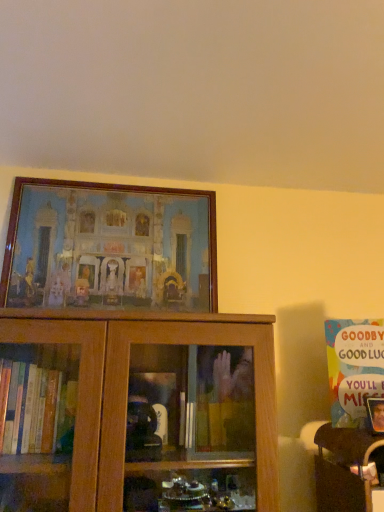
Question: Should I look upward or downward to see wooden picture frame at upper center?

Choices:
 (A) down
 (B) up

Answer: (B)

Question: Is wooden picture frame at upper center bigger than multicolored paper card at upper right?

Choices:
 (A) yes
 (B) no

Answer: (A)

Question: Would you consider wooden picture frame at upper center to be distant from multicolored paper card at upper right?

Choices:
 (A) no
 (B) yes

Answer: (A)

Question: Is wooden picture frame at upper center further to the viewer compared to multicolored paper card at upper right?

Choices:
 (A) yes
 (B) no

Answer: (A)

Question: Is wooden picture frame at upper center wider than multicolored paper card at upper right?

Choices:
 (A) yes
 (B) no

Answer: (A)

Question: Does wooden picture frame at upper center come in front of multicolored paper card at upper right?

Choices:
 (A) no
 (B) yes

Answer: (A)

Question: From the image's perspective, is wooden picture frame at upper center on multicolored paper card at upper right?

Choices:
 (A) yes
 (B) no

Answer: (A)

Question: From the image's perspective, is wooden picture frame at upper center under wooden table at lower right?

Choices:
 (A) yes
 (B) no

Answer: (B)

Question: Considering the relative positions of wooden picture frame at upper center and wooden table at lower right in the image provided, is wooden picture frame at upper center to the left of wooden table at lower right from the viewer's perspective?

Choices:
 (A) yes
 (B) no

Answer: (A)

Question: Is wooden picture frame at upper center thinner than wooden table at lower right?

Choices:
 (A) no
 (B) yes

Answer: (B)

Question: Does wooden picture frame at upper center appear on the right side of wooden table at lower right?

Choices:
 (A) no
 (B) yes

Answer: (A)

Question: Is wooden picture frame at upper center looking in the opposite direction of wooden table at lower right?

Choices:
 (A) no
 (B) yes

Answer: (A)

Question: Does wooden picture frame at upper center have a larger size compared to wooden table at lower right?

Choices:
 (A) yes
 (B) no

Answer: (A)

Question: Can we say wooden table at lower right lies outside wooden picture frame at upper center?

Choices:
 (A) no
 (B) yes

Answer: (B)